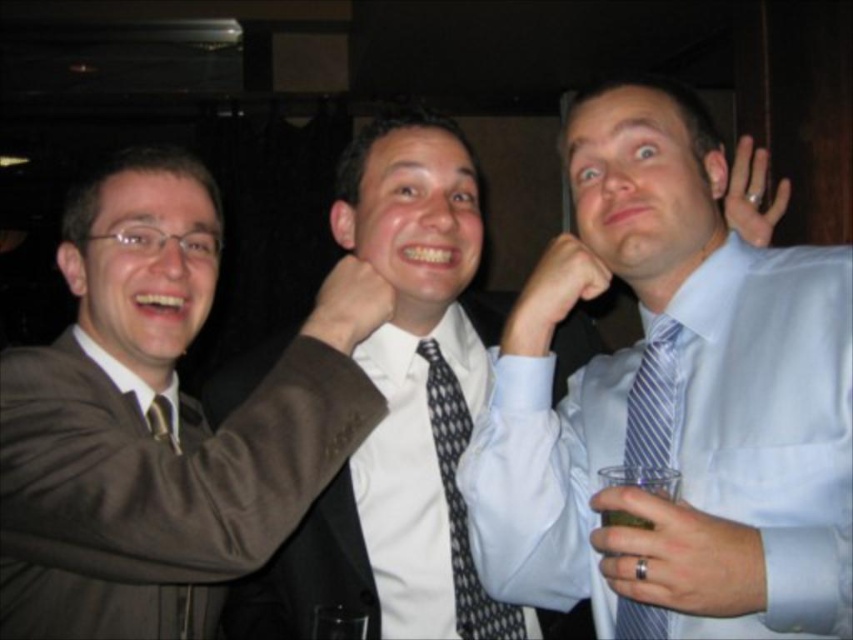
Question: Which point is farther to the camera?

Choices:
 (A) matte brown suit at left
 (B) silver metallic ring at upper right

Answer: (A)

Question: Can you confirm if matte brown suit at left is thinner than black dotted tie at center?

Choices:
 (A) yes
 (B) no

Answer: (B)

Question: Is silver metallic ring at upper right wider than blue striped tie at right?

Choices:
 (A) no
 (B) yes

Answer: (B)

Question: Among these objects, which one is nearest to the camera?

Choices:
 (A) matte silver ring at upper right
 (B) silver metallic ring at upper right
 (C) matte brown suit at left

Answer: (B)

Question: From the image, what is the correct spatial relationship of matte brown suit at left in relation to silver metallic ring at upper right?

Choices:
 (A) right
 (B) left

Answer: (B)

Question: Which object is closer to the camera taking this photo?

Choices:
 (A) matte skin hand at center
 (B) black dotted tie at center
 (C) matte brown suit at left

Answer: (C)